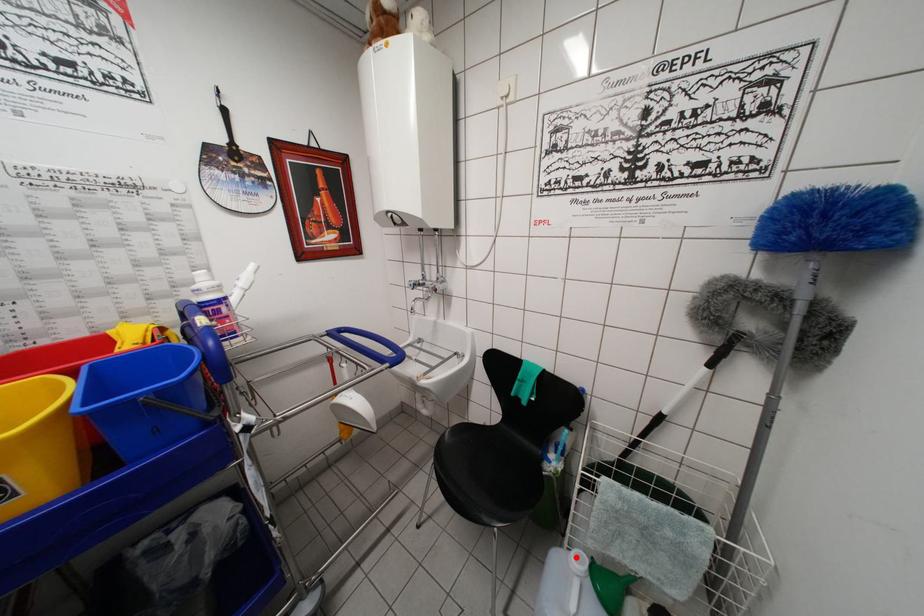
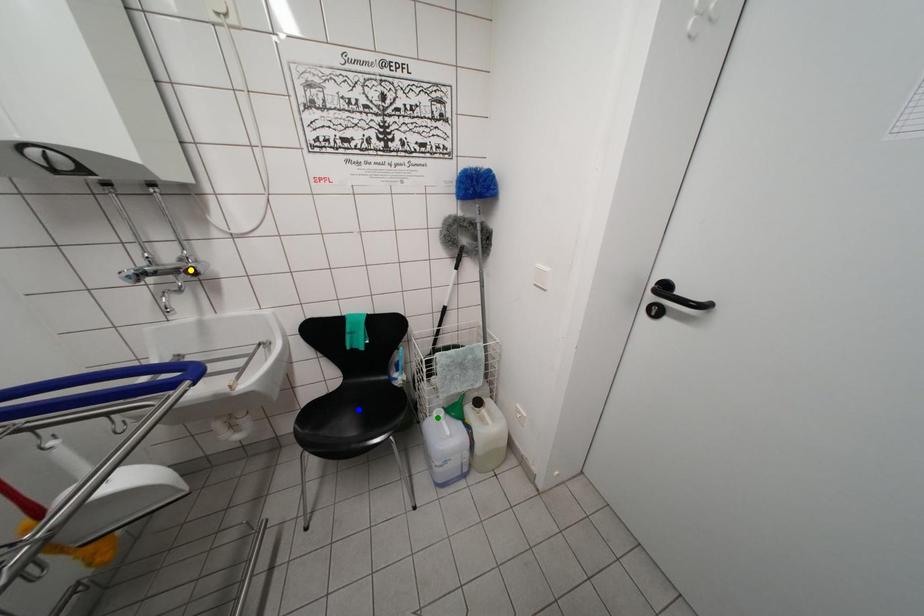
Question: I am providing you with two images of the same scene from different viewpoints. A red point is marked on the first image. You are given multiple points on the second image. Which point in image 2 represents the same 3d spot as the red point in image 1?

Choices:
 (A) green point
 (B) blue point
 (C) yellow point

Answer: (A)